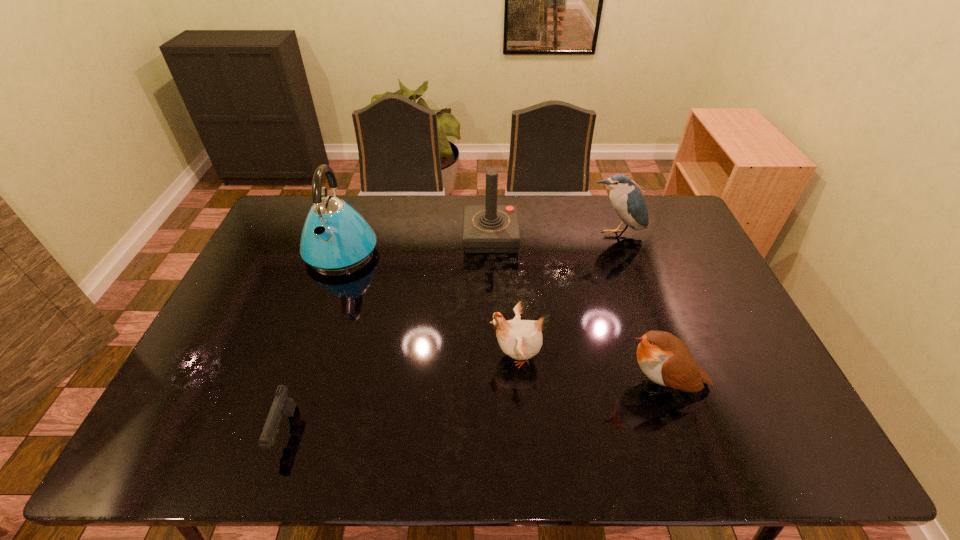
Identify the location of free space at the far edge of the desktop. The width and height of the screenshot is (960, 540). (380, 197).

This screenshot has height=540, width=960. Identify the location of vacant area at the near edge of the desktop. (323, 450).

Find the location of `free space at the left edge`. free space at the left edge is located at coordinates coord(269,242).

In the image, there is a desktop. At what (x,y) coordinates should I click in order to perform the action: click on vacant space at the right edge. Please return your answer as a coordinate pair (x, y). Looking at the image, I should click on (684, 261).

Find the location of a particular element. blank space at the near left corner is located at coordinates (169, 441).

This screenshot has height=540, width=960. I want to click on free region at the far right corner of the desktop, so click(653, 224).

You are a GUI agent. You are given a task and a screenshot of the screen. Output one action in this format:
    pyautogui.click(x=<x>, y=<y>)
    Task: Click on the free location at the near right corner of the desktop
    The height and width of the screenshot is (540, 960).
    Given the screenshot: What is the action you would take?
    pyautogui.click(x=759, y=441)

Identify the location of free spot between the shortest object and the joystick. (388, 334).

Identify the location of vacant space that's between the kettle and the joystick. Image resolution: width=960 pixels, height=540 pixels. (416, 244).

Locate an element on the screen. The height and width of the screenshot is (540, 960). free point between the tallest object and the shortest object is located at coordinates (313, 341).